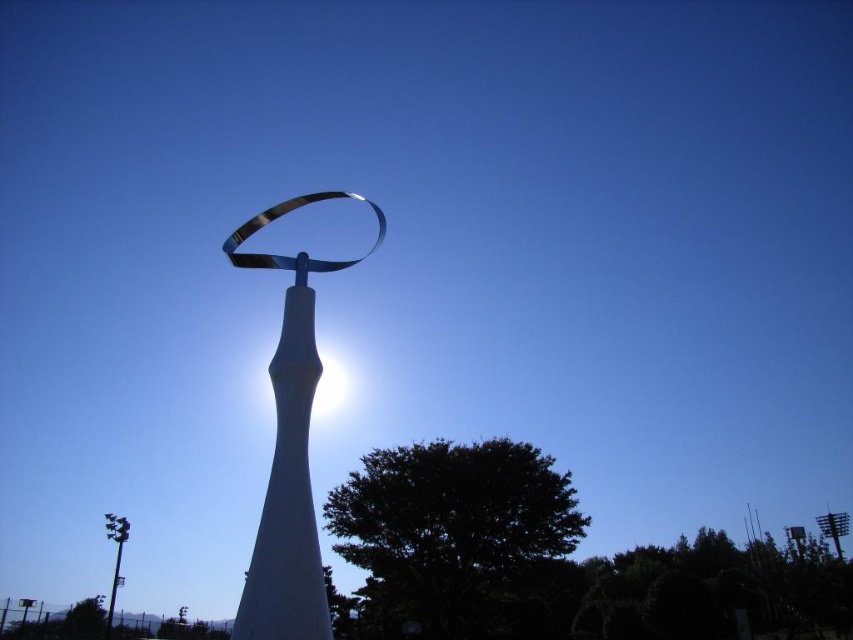
You are an art student analyzing the sculpture. You notice the sleek silver ribbon at center and the metallic gray pole at lower left. Which object is positioned higher in the image?

The sleek silver ribbon at center is positioned higher than the metallic gray pole at lower left.

You are an artist planning to sketch the sculpture. You need to know which object is thinner between the sleek silver ribbon at center and the metallic gray pole at lower left. Which one should you depict as thinner?

The sleek silver ribbon at center is thinner than the metallic gray pole at lower left according to the description.

You are an artist planning to paint the sculpture. You notice the sleek silver ribbon at center and the metallic gray pole at lower left. Which object should you focus on first if you want to paint the tallest part of the sculpture first?

The sleek silver ribbon at center is taller than the metallic gray pole at lower left, so you should focus on painting the sleek silver ribbon at center first.